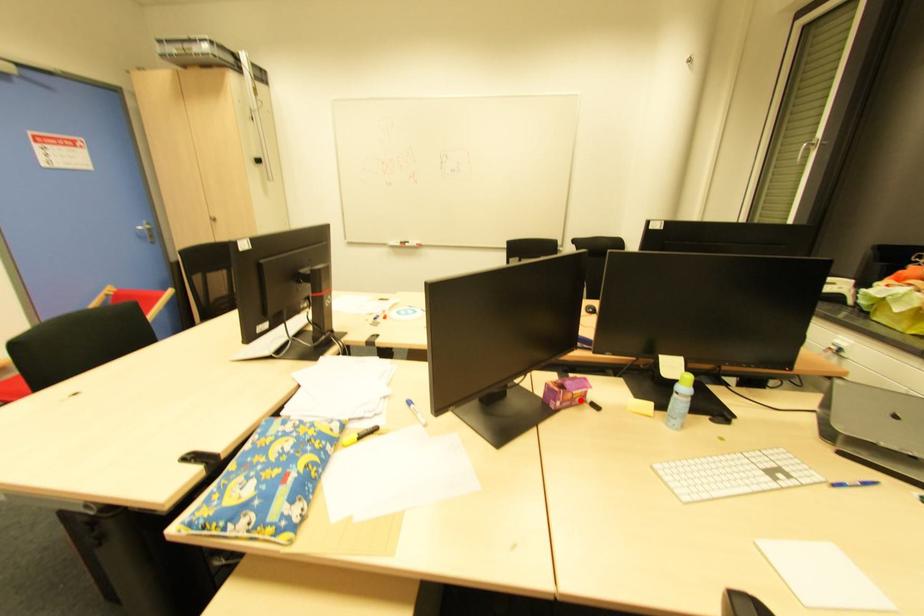
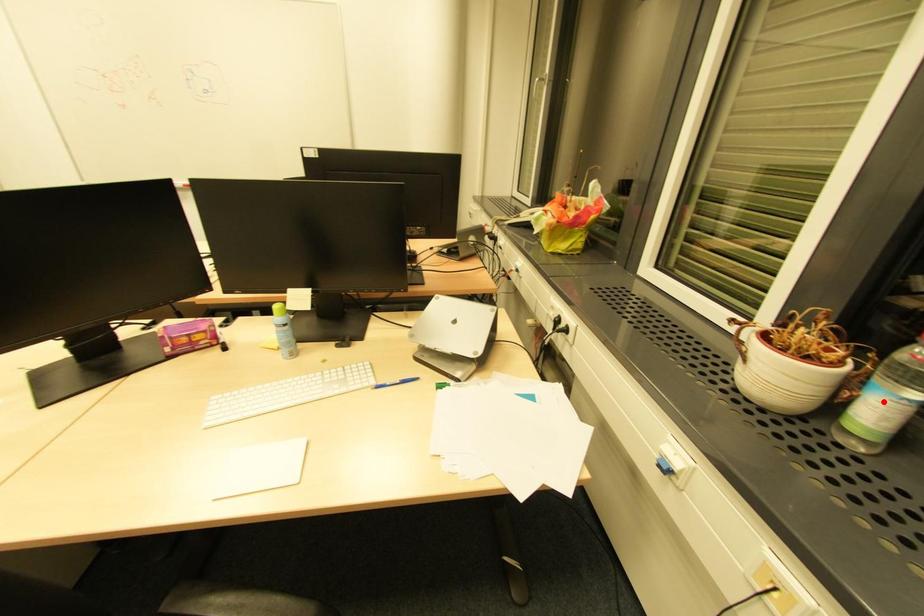
I am providing you with two images of the same scene from different viewpoints. A red point is marked on the first image and another point is marked on the second image. Do the highlighted points in image1 and image2 indicate the same real-world spot?

No